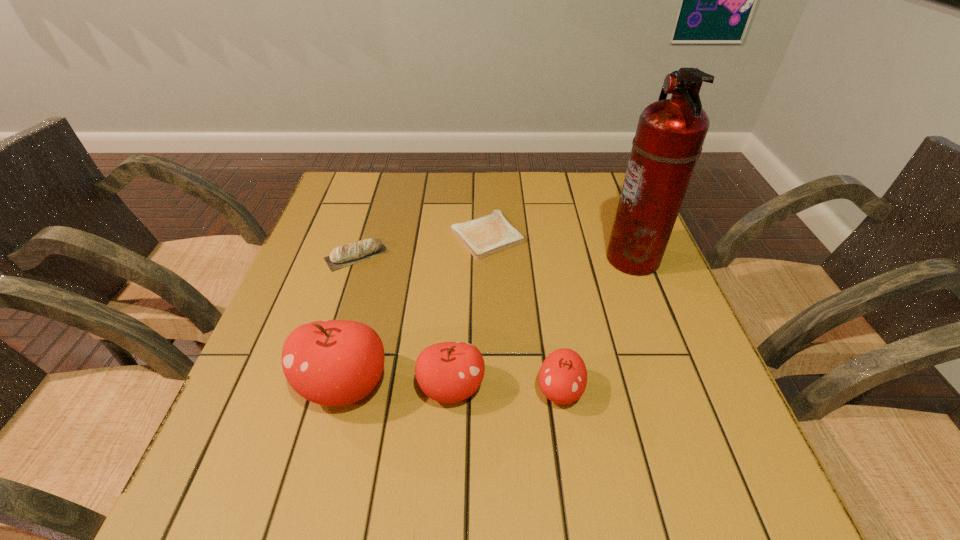
Find the location of `free space between the toast and the shortest apple`. free space between the toast and the shortest apple is located at coordinates [524, 313].

Locate an element on the screen. The image size is (960, 540). free spot between the fire extinguisher and the rightmost apple is located at coordinates (596, 325).

The width and height of the screenshot is (960, 540). I want to click on vacant point located between the third tallest object and the tallest object, so click(542, 323).

The image size is (960, 540). Find the location of `free point between the rightmost apple and the second shortest object`. free point between the rightmost apple and the second shortest object is located at coordinates (458, 323).

Locate an element on the screen. Image resolution: width=960 pixels, height=540 pixels. blank region between the third tallest object and the rightmost apple is located at coordinates (506, 389).

At what (x,y) coordinates should I click in order to perform the action: click on empty location between the third tallest object and the pita bread. Please return your answer as a coordinate pair (x, y). The height and width of the screenshot is (540, 960). Looking at the image, I should click on (404, 321).

The height and width of the screenshot is (540, 960). Find the location of `vacant region between the rightmost apple and the second apple from left to right`. vacant region between the rightmost apple and the second apple from left to right is located at coordinates (506, 389).

You are a GUI agent. You are given a task and a screenshot of the screen. Output one action in this format:
    pyautogui.click(x=<x>, y=<y>)
    Task: Click on the free space between the leftmost apple and the pita bread
    
    Given the screenshot: What is the action you would take?
    pyautogui.click(x=350, y=320)

Locate an element on the screen. Image resolution: width=960 pixels, height=540 pixels. free space between the tallest object and the second shortest object is located at coordinates (494, 256).

This screenshot has height=540, width=960. In order to click on object identified as the third closest to the second tallest object in this screenshot , I will do `click(563, 376)`.